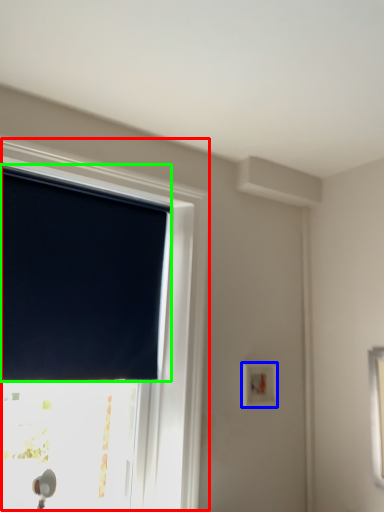
Question: Estimate the real-world distances between objects in this image. Which object is farther from window (highlighted by a red box), light switch (highlighted by a blue box) or window blind (highlighted by a green box)?

Choices:
 (A) light switch
 (B) window blind

Answer: (A)